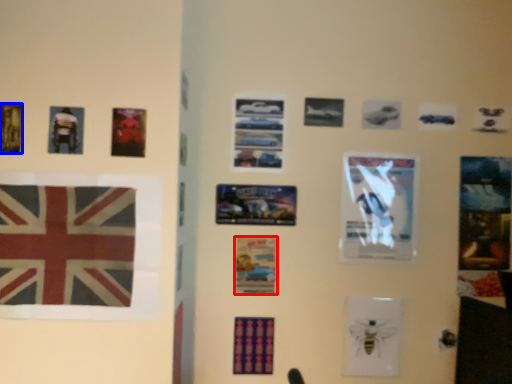
Question: Which of the following is the closest to the observer, poster (highlighted by a red box) or poster (highlighted by a blue box)?

Choices:
 (A) poster
 (B) poster

Answer: (B)